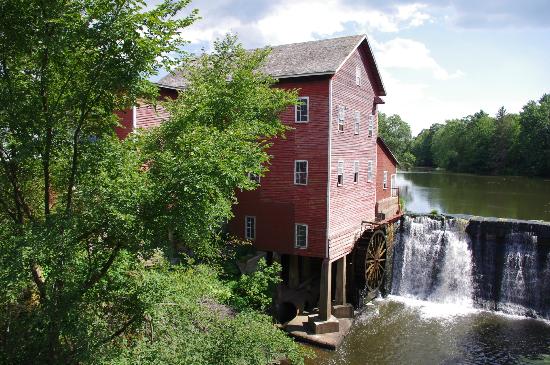
I want to click on open windows, so click(x=338, y=179), click(x=358, y=181).